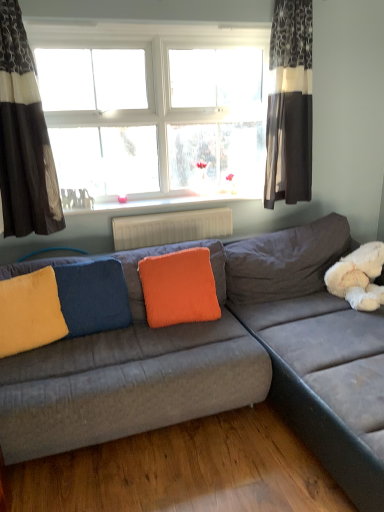
What is the approximate width of white plastic radiator at center?

white plastic radiator at center is 3.77 inches wide.

The width and height of the screenshot is (384, 512). Describe the element at coordinates (93, 296) in the screenshot. I see `blue velvet pillow at center, the 2th pillow when ordered from right to left` at that location.

What do you see at coordinates (320, 372) in the screenshot?
I see `velvet gray couch at center` at bounding box center [320, 372].

Measure the distance between point (60,226) and camera.

2.73 meters.

How much space does dark gray textured curtain at left, the second curtain when ordered from right to left, occupy vertically?

The height of dark gray textured curtain at left, the second curtain when ordered from right to left, is 1.31 meters.

Find the location of a particular element. The width and height of the screenshot is (384, 512). orange fuzzy pillow at center, positioned as the 1th pillow in right-to-left order is located at coordinates (179, 288).

Image resolution: width=384 pixels, height=512 pixels. What do you see at coordinates (289, 104) in the screenshot? I see `textured gray curtain at upper right, which is the second curtain in left-to-right order` at bounding box center [289, 104].

Locate an element on the screen. This screenshot has height=512, width=384. white glass window at upper center is located at coordinates (161, 92).

From a real-world perspective, which is physically below, white glass window at upper center or white plastic radiator at center?

white plastic radiator at center.

Does point (62, 180) appear closer or farther from the camera than point (131, 239)?

Point (62, 180) appears to be closer to the viewer than point (131, 239).

Does white glass window at upper center have a larger size compared to white plastic radiator at center?

Yes.

Would you say white glass window at upper center is inside or outside white plastic radiator at center?

white glass window at upper center cannot be found inside white plastic radiator at center.

Which object is thinner, white glass window at upper center or white glossy radiator at upper center?

With smaller width is white glass window at upper center.

Considering the positions of point (171, 36) and point (138, 204), is point (171, 36) closer or farther from the camera than point (138, 204)?

Point (171, 36) is closer to the camera than point (138, 204).

Considering the relative sizes of white glass window at upper center and white glossy radiator at upper center in the image provided, is white glass window at upper center smaller than white glossy radiator at upper center?

Actually, white glass window at upper center might be larger than white glossy radiator at upper center.

Is white glass window at upper center looking in the opposite direction of white glossy radiator at upper center?

white glass window at upper center is not turned away from white glossy radiator at upper center.

Does point (29, 315) appear closer or farther from the camera than point (62, 195)?

Point (29, 315) is positioned closer to the camera compared to point (62, 195).

From the image's perspective, which is below, yellow fuzzy pillow at left, acting as the 1th pillow starting from the left, or white glossy radiator at upper center?

yellow fuzzy pillow at left, acting as the 1th pillow starting from the left.

Is yellow fuzzy pillow at left, acting as the 1th pillow starting from the left, spatially inside white glossy radiator at upper center, or outside of it?

The correct answer is: outside.

Are yellow fuzzy pillow at left, acting as the 1th pillow starting from the left, and white glossy radiator at upper center beside each other?

There is a gap between yellow fuzzy pillow at left, acting as the 1th pillow starting from the left, and white glossy radiator at upper center.

From the image's perspective, which is below, orange fuzzy pillow at center, positioned as the 1th pillow in right-to-left order, or white glossy radiator at upper center?

orange fuzzy pillow at center, positioned as the 1th pillow in right-to-left order.

Is orange fuzzy pillow at center, arranged as the 3th pillow when viewed from the left, bigger than white glossy radiator at upper center?

Indeed, orange fuzzy pillow at center, arranged as the 3th pillow when viewed from the left, has a larger size compared to white glossy radiator at upper center.

Is orange fuzzy pillow at center, positioned as the 1th pillow in right-to-left order, touching white glossy radiator at upper center?

No, orange fuzzy pillow at center, positioned as the 1th pillow in right-to-left order, is not next to white glossy radiator at upper center.

Is point (201, 275) closer or farther from the camera than point (195, 207)?

Point (201, 275).

Is white glossy radiator at upper center taller or shorter than dark gray textured curtain at left, positioned as the first curtain in left-to-right order?

Considering their sizes, white glossy radiator at upper center has less height than dark gray textured curtain at left, positioned as the first curtain in left-to-right order.

Could you tell me if white glossy radiator at upper center is turned towards dark gray textured curtain at left, the second curtain when ordered from right to left?

No, white glossy radiator at upper center is not oriented towards dark gray textured curtain at left, the second curtain when ordered from right to left.

Considering the relative positions of white glossy radiator at upper center and dark gray textured curtain at left, the second curtain when ordered from right to left, in the image provided, is white glossy radiator at upper center in front of dark gray textured curtain at left, the second curtain when ordered from right to left,?

No.

At what (x,y) coordinates should I click in order to perform the action: click on radiator on the left of the textured gray curtain at upper right, which is the second curtain in left-to-right order. Please return your answer as a coordinate pair (x, y). The width and height of the screenshot is (384, 512). Looking at the image, I should click on (171, 228).

Is white plastic radiator at center not near textured gray curtain at upper right, arranged as the 1th curtain when viewed from the right?

That's not correct — white plastic radiator at center is a little close to textured gray curtain at upper right, arranged as the 1th curtain when viewed from the right.

Is white plastic radiator at center wider than textured gray curtain at upper right, arranged as the 1th curtain when viewed from the right?

In fact, white plastic radiator at center might be narrower than textured gray curtain at upper right, arranged as the 1th curtain when viewed from the right.

Can you tell me how much white glossy radiator at upper center and blue velvet pillow at center, the 2th pillow when ordered from right to left, differ in facing direction?

They differ by 0.872 degrees in their facing directions.

In terms of size, does white glossy radiator at upper center appear bigger or smaller than blue velvet pillow at center, the 2th pillow when ordered from right to left?

Clearly, white glossy radiator at upper center is smaller in size than blue velvet pillow at center, the 2th pillow when ordered from right to left.

From the image's perspective, does white glossy radiator at upper center appear lower than blue velvet pillow at center, the 2th pillow when ordered from right to left?

Incorrect, from the image's perspective, white glossy radiator at upper center is higher than blue velvet pillow at center, the 2th pillow when ordered from right to left.

Does white glossy radiator at upper center have a greater width compared to blue velvet pillow at center, the 2th pillow when ordered from right to left?

Indeed, white glossy radiator at upper center has a greater width compared to blue velvet pillow at center, the 2th pillow when ordered from right to left.

The image size is (384, 512). I want to click on radiator lying on the right of white glass window at upper center, so click(171, 228).

This screenshot has width=384, height=512. Identify the location of window above the white glossy radiator at upper center (from the image's perspective). (161, 92).

From the image, which object appears to be nearer to white glossy radiator at upper center, white glass window at upper center or white plastic radiator at center?

The object closer to white glossy radiator at upper center is white plastic radiator at center.

When comparing their distances from velvet gray couch at center, does white glass window at upper center or dark gray textured curtain at left, the second curtain when ordered from right to left, seem further?

dark gray textured curtain at left, the second curtain when ordered from right to left, lies further to velvet gray couch at center than the other object.

Looking at the image, which one is located further to velvet gray couch at center, white plastic radiator at center or blue velvet pillow at center, the 2th pillow when ordered from right to left?

The object further to velvet gray couch at center is blue velvet pillow at center, the 2th pillow when ordered from right to left.

Looking at the image, which one is located further to white glass window at upper center, orange fuzzy pillow at center, positioned as the 1th pillow in right-to-left order, or white glossy radiator at upper center?

orange fuzzy pillow at center, positioned as the 1th pillow in right-to-left order.

Considering their positions, is dark gray textured curtain at left, the second curtain when ordered from right to left, positioned closer to orange fuzzy pillow at center, arranged as the 3th pillow when viewed from the left, than textured gray curtain at upper right, which is the second curtain in left-to-right order?

dark gray textured curtain at left, the second curtain when ordered from right to left, is positioned closer to the anchor orange fuzzy pillow at center, arranged as the 3th pillow when viewed from the left.

Which object lies further to the anchor point textured gray curtain at upper right, arranged as the 1th curtain when viewed from the right, orange fuzzy pillow at center, arranged as the 3th pillow when viewed from the left, or yellow fuzzy pillow at left, arranged as the third pillow when viewed from the right?

The object further to textured gray curtain at upper right, arranged as the 1th curtain when viewed from the right, is yellow fuzzy pillow at left, arranged as the third pillow when viewed from the right.

When comparing their distances from white glossy radiator at upper center, does white plastic radiator at center or yellow fuzzy pillow at left, arranged as the third pillow when viewed from the right, seem closer?

Result: white plastic radiator at center lies closer to white glossy radiator at upper center than the other object.

Estimate the real-world distances between objects in this image. Which object is closer to velvet gray couch at center, yellow fuzzy pillow at left, arranged as the third pillow when viewed from the right, or orange fuzzy pillow at center, positioned as the 1th pillow in right-to-left order?

orange fuzzy pillow at center, positioned as the 1th pillow in right-to-left order.

In order to click on window sill that lies between white glass window at upper center and white plastic radiator at center from top to bottom in this screenshot , I will do `click(138, 202)`.

You are a GUI agent. You are given a task and a screenshot of the screen. Output one action in this format:
    pyautogui.click(x=<x>, y=<y>)
    Task: Click on the radiator between white glossy radiator at upper center and orange fuzzy pillow at center, positioned as the 1th pillow in right-to-left order, in the up-down direction
    The width and height of the screenshot is (384, 512).
    Given the screenshot: What is the action you would take?
    pyautogui.click(x=171, y=228)

The width and height of the screenshot is (384, 512). I want to click on window between yellow fuzzy pillow at left, arranged as the third pillow when viewed from the right, and textured gray curtain at upper right, arranged as the 1th curtain when viewed from the right, in the horizontal direction, so click(x=161, y=92).

Where is `window sill between textured gray curtain at upper right, which is the second curtain in left-to-right order, and orange fuzzy pillow at center, arranged as the 3th pillow when viewed from the left, from top to bottom`? The image size is (384, 512). window sill between textured gray curtain at upper right, which is the second curtain in left-to-right order, and orange fuzzy pillow at center, arranged as the 3th pillow when viewed from the left, from top to bottom is located at coordinates (138, 202).